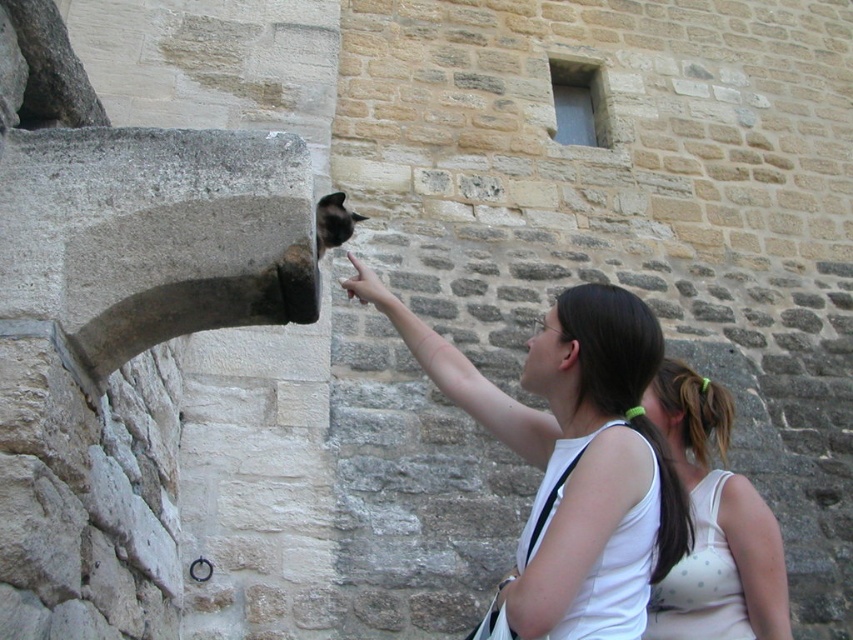
Question: Is white tank top at center positioned before white polka dot tank top at lower right?

Choices:
 (A) no
 (B) yes

Answer: (B)

Question: Does white tank top at center come in front of white polka dot tank top at lower right?

Choices:
 (A) yes
 (B) no

Answer: (A)

Question: Is white tank top at center below white polka dot tank top at lower right?

Choices:
 (A) no
 (B) yes

Answer: (A)